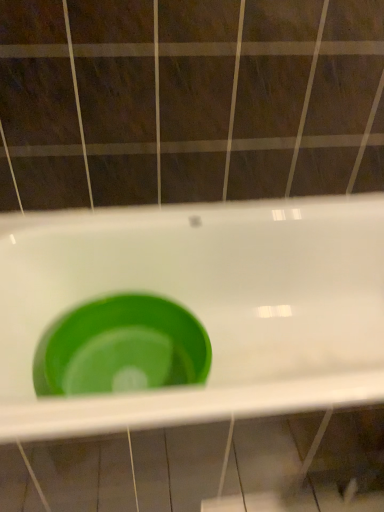
Find the location of a particular element. The width and height of the screenshot is (384, 512). green plastic basin at center is located at coordinates (122, 348).

Measure the distance between green plastic basin at center and camera.

The depth of green plastic basin at center is 3.67 feet.

The image size is (384, 512). Describe the element at coordinates (122, 348) in the screenshot. I see `green plastic basin at center` at that location.

The height and width of the screenshot is (512, 384). I want to click on green plastic sink at center, so click(x=204, y=305).

The image size is (384, 512). Describe the element at coordinates (204, 305) in the screenshot. I see `green plastic sink at center` at that location.

In order to face green plastic sink at center, should I rotate leftwards or rightwards?

To align with it, rotate right about 4.690°.

Locate an element on the screen. This screenshot has height=512, width=384. green plastic basin at center is located at coordinates (122, 348).

Considering the relative positions of green plastic sink at center and green plastic basin at center in the image provided, is green plastic sink at center to the right of green plastic basin at center from the viewer's perspective?

Correct, you'll find green plastic sink at center to the right of green plastic basin at center.

Which is behind, green plastic sink at center or green plastic basin at center?

green plastic basin at center is more distant.

Does point (357, 201) appear closer or farther from the camera than point (178, 380)?

Point (357, 201).

From the image's perspective, which is above, green plastic sink at center or green plastic basin at center?

green plastic basin at center.

From a real-world perspective, who is located lower, green plastic sink at center or green plastic basin at center?

green plastic basin at center is physically lower.

Based on the photo, between green plastic sink at center and green plastic basin at center, which one has smaller width?

Thinner between the two is green plastic basin at center.

Which of these two, green plastic sink at center or green plastic basin at center, stands shorter?

green plastic basin at center.

Based on their sizes in the image, would you say green plastic sink at center is bigger or smaller than green plastic basin at center?

In the image, green plastic sink at center appears to be larger than green plastic basin at center.

Would you say green plastic sink at center contains green plastic basin at center?

Indeed, green plastic basin at center is located within green plastic sink at center.

Consider the image. Is green plastic sink at center in contact with green plastic basin at center?

No, green plastic sink at center is not touching green plastic basin at center.

Is green plastic sink at center facing away from green plastic basin at center?

Correct, green plastic sink at center is looking away from green plastic basin at center.

You are a GUI agent. You are given a task and a screenshot of the screen. Output one action in this format:
    pyautogui.click(x=<x>, y=<y>)
    Task: Click on the sink in front of the green plastic basin at center
    
    Given the screenshot: What is the action you would take?
    [x=204, y=305]

Considering the positions of objects green plastic basin at center and green plastic sink at center in the image provided, who is more to the left, green plastic basin at center or green plastic sink at center?

green plastic basin at center is more to the left.

Is green plastic basin at center closer to the viewer compared to green plastic sink at center?

No, it is not.

Which point is more forward, (141, 334) or (208, 394)?

Point (208, 394)

Consider the image. From the image's perspective, between green plastic basin at center and green plastic sink at center, who is located below?

green plastic sink at center appears lower in the image.

From a real-world perspective, is green plastic basin at center below green plastic sink at center?

Yes, from a real-world perspective, green plastic basin at center is beneath green plastic sink at center.

Which of these two, green plastic basin at center or green plastic sink at center, is wider?

green plastic sink at center.

Which of these two, green plastic basin at center or green plastic sink at center, stands shorter?

green plastic basin at center.

Considering the sizes of objects green plastic basin at center and green plastic sink at center in the image provided, who is bigger, green plastic basin at center or green plastic sink at center?

With larger size is green plastic sink at center.

From the picture: Could green plastic sink at center be considered to be inside green plastic basin at center?

No, green plastic basin at center does not contain green plastic sink at center.

Would you consider green plastic basin at center to be distant from green plastic sink at center?

No, there isn't a large distance between green plastic basin at center and green plastic sink at center.

Is green plastic sink at center at the back of green plastic basin at center?

Yes, green plastic sink at center is at the back of green plastic basin at center.

How many degrees apart are the facing directions of green plastic basin at center and green plastic sink at center?

0.389 degrees.

How distant is green plastic basin at center from green plastic sink at center?

green plastic basin at center and green plastic sink at center are 8.10 inches apart from each other.

Locate an element on the screen. The height and width of the screenshot is (512, 384). sink that is in front of the green plastic basin at center is located at coordinates (204, 305).

Where is `basin on the left of green plastic sink at center`? Image resolution: width=384 pixels, height=512 pixels. basin on the left of green plastic sink at center is located at coordinates 122,348.

Locate an element on the screen. The width and height of the screenshot is (384, 512). sink to the right of green plastic basin at center is located at coordinates (204, 305).